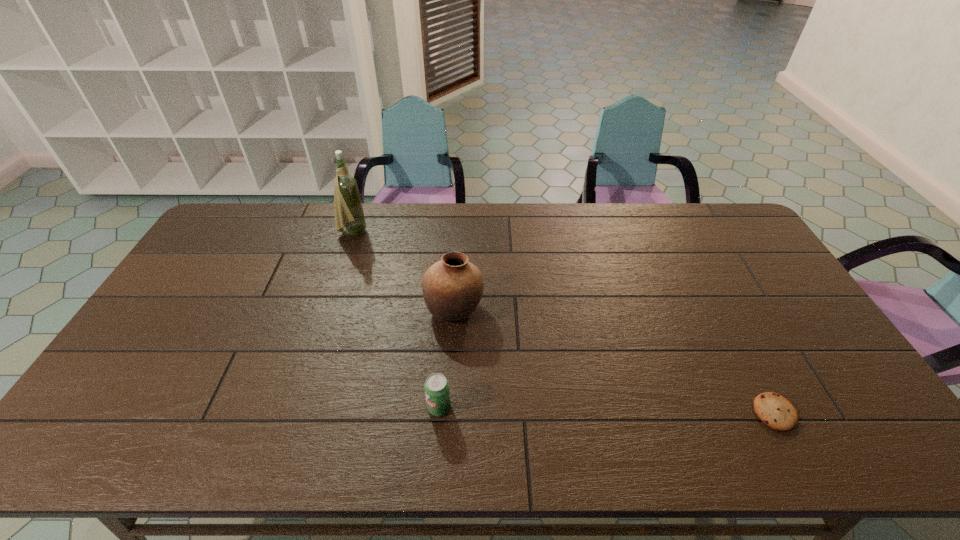
The image size is (960, 540). Identify the location of unoccupied area between the leftmost object and the soda. (396, 320).

Locate an element on the screen. The width and height of the screenshot is (960, 540). free spot between the shortest object and the third tallest object is located at coordinates click(607, 410).

Find the location of a particular element. empty space that is in between the third tallest object and the shortest object is located at coordinates pos(607,410).

You are a GUI agent. You are given a task and a screenshot of the screen. Output one action in this format:
    pyautogui.click(x=<x>, y=<y>)
    Task: Click on the free area in between the shortest object and the third shortest object
    The image size is (960, 540).
    Given the screenshot: What is the action you would take?
    pyautogui.click(x=614, y=361)

Locate an element on the screen. This screenshot has width=960, height=540. empty space between the tallest object and the shortest object is located at coordinates (564, 322).

Locate an element on the screen. free space between the farthest object and the soda is located at coordinates (396, 320).

Where is `free point between the cookie and the pottery`? This screenshot has height=540, width=960. free point between the cookie and the pottery is located at coordinates (614, 361).

I want to click on empty space that is in between the tallest object and the second shortest object, so click(x=396, y=320).

Identify the location of object that can be found as the second closest to the third tallest object. This screenshot has height=540, width=960. (348, 209).

What are the coordinates of `object that can be found as the third closest to the second farthest object` in the screenshot? It's located at (774, 410).